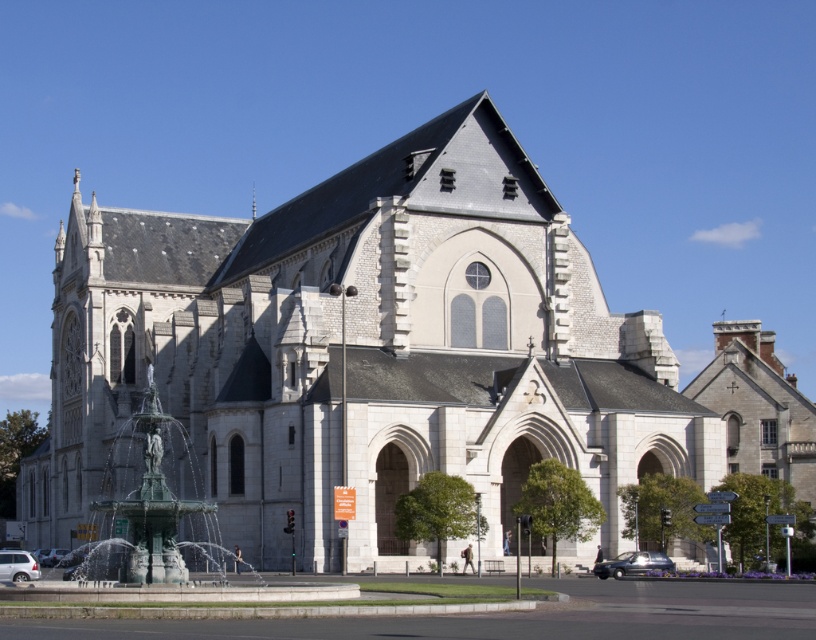
You are a photographer planning to take a picture of the white stone church at center and the green patinated bronze fountain at lower left. Based on their positions, which object should appear higher in your photo?

The white stone church at center appears higher in the photo because it is positioned above the green patinated bronze fountain at lower left.

Looking at this image, you are a parking attendant who needs to fit both the shiny black sedan at lower right and the metallic silver car at lower left into a parking space that is 2 meters wide. Can both cars fit side by side in the space?

The shiny black sedan at lower right has a lesser width compared to metallic silver car at lower left. Since the parking space is 2 meters wide, it depends on the combined width of both cars. However, without specific measurements, it is impossible to determine if they can fit side by side.

You are a photographer planning to capture the grand church in the background while including both the green patinated bronze fountain at lower left and the silver metallic car at lower left in your shot. Which object should you position closer to the camera to ensure both are visible in the frame without cropping?

To ensure both the green patinated bronze fountain at lower left and the silver metallic car at lower left are visible without cropping, position the green patinated bronze fountain at lower left closer to the camera since it is wider than the silver metallic car at lower left. This way, the wider fountain can occupy more space near the camera while still allowing the narrower car to fit within the frame.